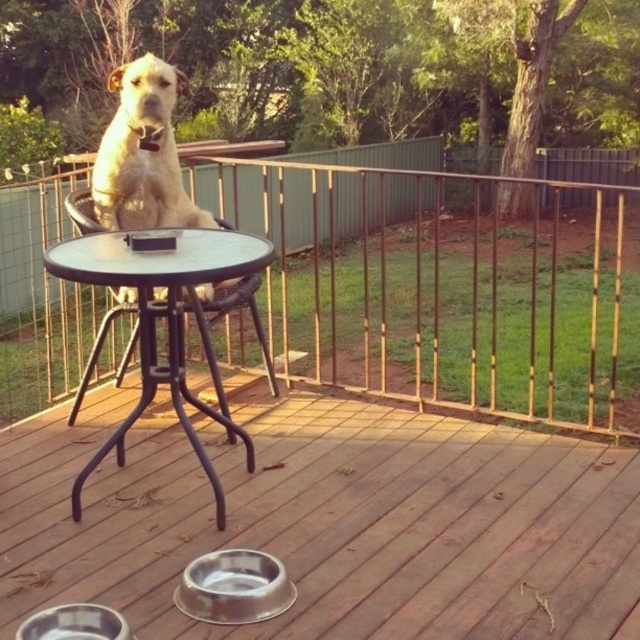
You are a dog owner who wants to place a new dog bed on the deck. The bed is as wide as the white fur dog at center. Can the bed fit in the space currently occupied by the metallic silver bowls at lower center?

The metallic silver bowls at lower center are wider than the white fur dog at center. Since the bed is as wide as the dog, it can fit in the space currently occupied by the metallic silver bowls at lower center because the bowls are wider, providing enough space.

In the scene shown: You are standing on the wooden deck and want to reach the black metal table at center. Which direction should you move relative to the metallic brown railing at upper center to get there?

To reach the black metal table at center, you should move behind the metallic brown railing at upper center since the black metal table at center is located behind it.